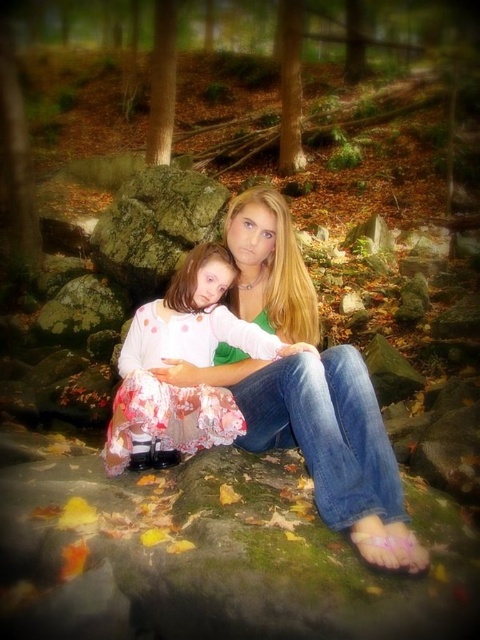
Who is higher up, white polka dot dress at center or green mossy rock at center?

green mossy rock at center is above.

Does point (228, 340) come farther from viewer compared to point (193, 195)?

No, (228, 340) is in front of (193, 195).

Identify the location of white polka dot dress at center. This screenshot has width=480, height=640. (181, 358).

What do you see at coordinates (181, 358) in the screenshot? This screenshot has height=640, width=480. I see `white polka dot dress at center` at bounding box center [181, 358].

Which is more to the left, white polka dot dress at center or green mossy rock at left?

Positioned to the left is green mossy rock at left.

Who is more forward, [194,282] or [91,320]?

Point [194,282]

Locate an element on the screen. white polka dot dress at center is located at coordinates (181, 358).

Is point (251, 406) more distant than point (105, 269)?

No, it is not.

Between matte green blouse at center and green mossy rock at center, which one has more height?

With more height is green mossy rock at center.

The height and width of the screenshot is (640, 480). I want to click on matte green blouse at center, so click(322, 438).